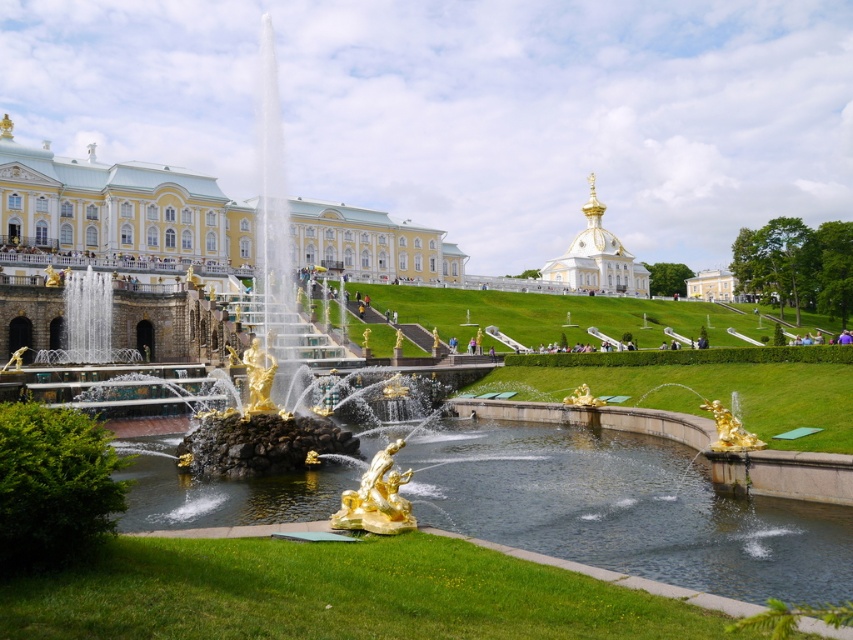
Is yellow/smooth/facade at center below gold metallic statue at center?

No.

Does yellow/smooth/facade at center lie in front of gold metallic statue at center?

No, it is not.

Does point (56, 182) come in front of point (251, 369)?

No, it is behind (251, 369).

I want to click on yellow/smooth/facade at center, so click(x=119, y=211).

Between gold plated dome at upper center and gold metallic statue at center, which one appears on the right side from the viewer's perspective?

Positioned to the right is gold plated dome at upper center.

What do you see at coordinates (596, 259) in the screenshot? This screenshot has width=853, height=640. I see `gold plated dome at upper center` at bounding box center [596, 259].

At what (x,y) coordinates should I click in order to perform the action: click on gold plated dome at upper center. Please return your answer as a coordinate pair (x, y). Looking at the image, I should click on (596, 259).

Does gold metallic statue at center appear under gold metallic statue at lower right?

No, gold metallic statue at center is not below gold metallic statue at lower right.

Is point (273, 406) farther from viewer compared to point (746, 445)?

Yes, it is behind point (746, 445).

This screenshot has width=853, height=640. What are the coordinates of `gold metallic statue at center` in the screenshot? It's located at (258, 380).